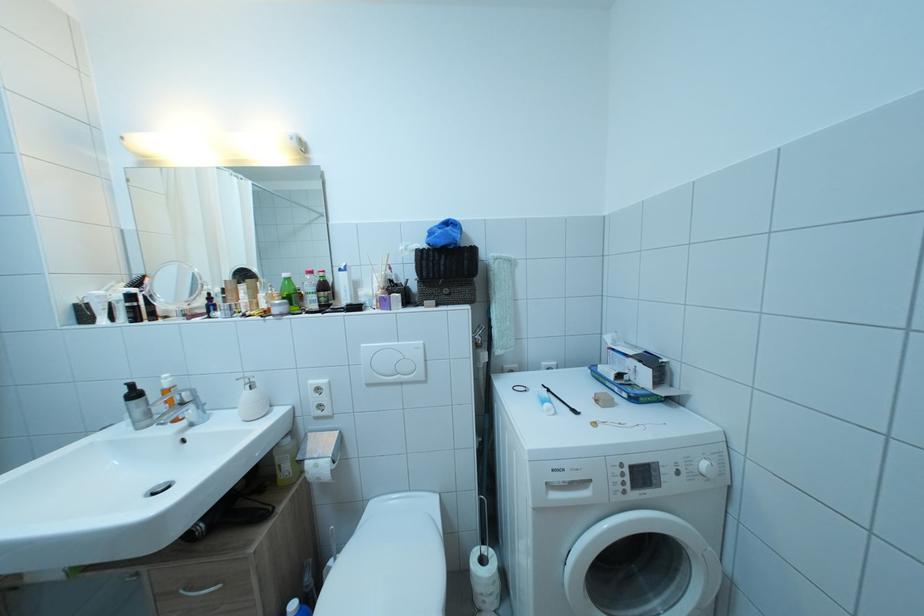
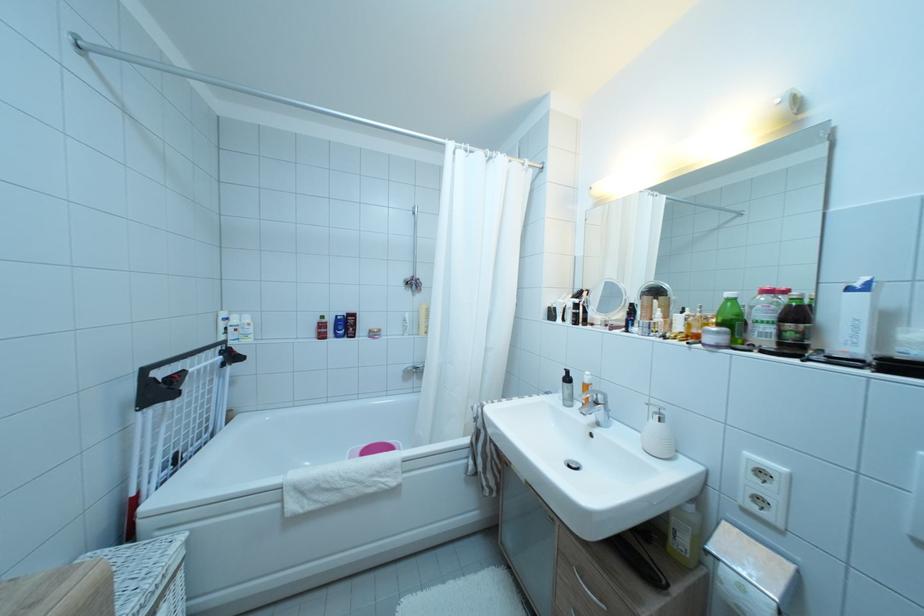
Locate, in the second image, the point that corresponds to (197,416) in the first image.

(606, 418)